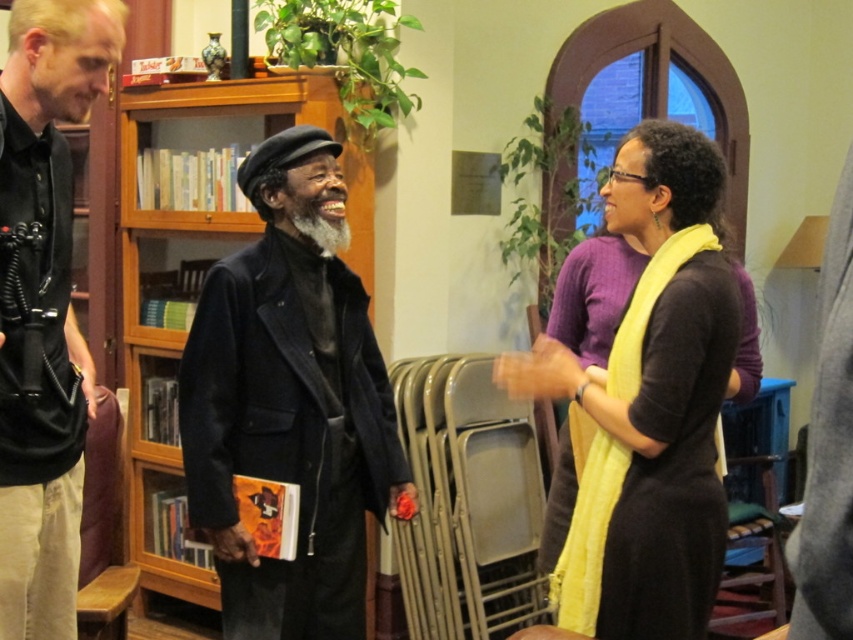
Question: Which of the following is the closest to the observer?

Choices:
 (A) pyautogui.click(x=13, y=499)
 (B) pyautogui.click(x=202, y=308)
 (C) pyautogui.click(x=704, y=467)
 (D) pyautogui.click(x=119, y=408)

Answer: (A)

Question: Which object appears farthest from the camera in this image?

Choices:
 (A) matte black jacket at center
 (B) dark purple sweater at center
 (C) black leather jacket at left

Answer: (A)

Question: Considering the relative positions of matte black jacket at center and black leather jacket at left in the image provided, where is matte black jacket at center located with respect to black leather jacket at left?

Choices:
 (A) above
 (B) below

Answer: (B)

Question: Does matte black jacket at center have a greater width compared to wooden at left?

Choices:
 (A) yes
 (B) no

Answer: (A)

Question: Which object appears closest to the camera in this image?

Choices:
 (A) wooden at left
 (B) matte black jacket at center
 (C) black leather jacket at left
 (D) dark purple sweater at center

Answer: (C)

Question: Where is matte black jacket at center located in relation to dark purple sweater at center in the image?

Choices:
 (A) below
 (B) above

Answer: (A)